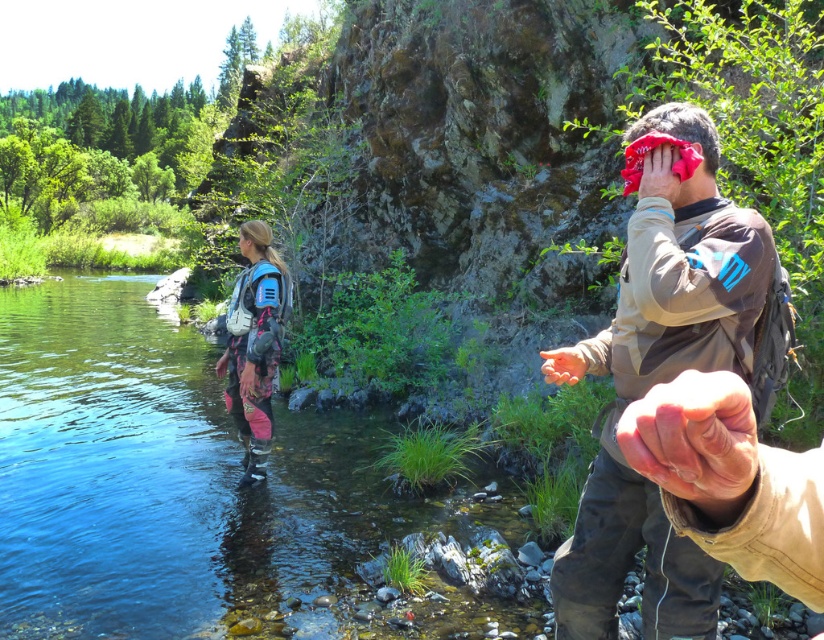
Does clear blue water at center have a lesser height compared to matte brown hand at center?

No.

Does clear blue water at center appear under matte brown hand at center?

Yes, clear blue water at center is below matte brown hand at center.

Is point (208, 410) behind point (569, 381)?

Yes, point (208, 410) is farther from viewer.

Identify the location of clear blue water at center. The width and height of the screenshot is (824, 640). (172, 480).

In the scene shown: Is clear blue water at center shorter than brown matte jacket at center?

No.

Is clear blue water at center wider than brown matte jacket at center?

Correct, the width of clear blue water at center exceeds that of brown matte jacket at center.

Between point (146, 285) and point (710, 634), which one is positioned behind?

Point (146, 285)

Find the location of a particular element. Image resolution: width=824 pixels, height=640 pixels. clear blue water at center is located at coordinates (172, 480).

Between brown matte jacket at center and matte brown hand at center, which one appears on the right side from the viewer's perspective?

Positioned to the right is brown matte jacket at center.

Consider the image. Is brown matte jacket at center positioned in front of matte brown hand at center?

Yes, it is.

The width and height of the screenshot is (824, 640). What do you see at coordinates (662, 376) in the screenshot?
I see `brown matte jacket at center` at bounding box center [662, 376].

This screenshot has height=640, width=824. Find the location of `brown matte jacket at center`. brown matte jacket at center is located at coordinates (662, 376).